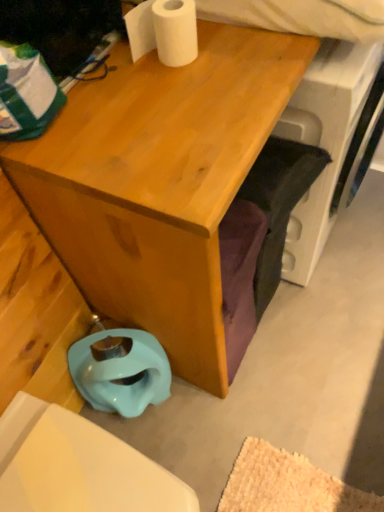
Question: Considering the relative positions of white matte toilet paper at upper center and matte wood desk at center in the image provided, is white matte toilet paper at upper center to the right of matte wood desk at center from the viewer's perspective?

Choices:
 (A) yes
 (B) no

Answer: (B)

Question: From the image's perspective, would you say white matte toilet paper at upper center is positioned over matte wood desk at center?

Choices:
 (A) no
 (B) yes

Answer: (B)

Question: Can you confirm if white matte toilet paper at upper center is taller than matte wood desk at center?

Choices:
 (A) yes
 (B) no

Answer: (B)

Question: Is the depth of white matte toilet paper at upper center greater than that of matte wood desk at center?

Choices:
 (A) no
 (B) yes

Answer: (B)

Question: From a real-world perspective, is white matte toilet paper at upper center positioned over matte wood desk at center based on gravity?

Choices:
 (A) no
 (B) yes

Answer: (B)

Question: Is white matte toilet paper at upper center located outside matte wood desk at center?

Choices:
 (A) no
 (B) yes

Answer: (B)

Question: Does white matte toilet paper at upper center have a larger size compared to light blue rubber toilet bowl at lower left?

Choices:
 (A) yes
 (B) no

Answer: (B)

Question: Does white matte toilet paper at upper center turn towards light blue rubber toilet bowl at lower left?

Choices:
 (A) no
 (B) yes

Answer: (A)

Question: Can you confirm if white matte toilet paper at upper center is smaller than light blue rubber toilet bowl at lower left?

Choices:
 (A) no
 (B) yes

Answer: (B)

Question: From a real-world perspective, is white matte toilet paper at upper center positioned over light blue rubber toilet bowl at lower left based on gravity?

Choices:
 (A) no
 (B) yes

Answer: (B)

Question: Are white matte toilet paper at upper center and light blue rubber toilet bowl at lower left located far from each other?

Choices:
 (A) yes
 (B) no

Answer: (B)

Question: Is white matte toilet paper at upper center directly adjacent to light blue rubber toilet bowl at lower left?

Choices:
 (A) no
 (B) yes

Answer: (A)

Question: Is light blue rubber toilet bowl at lower left in contact with white matte toilet paper at upper center?

Choices:
 (A) no
 (B) yes

Answer: (A)